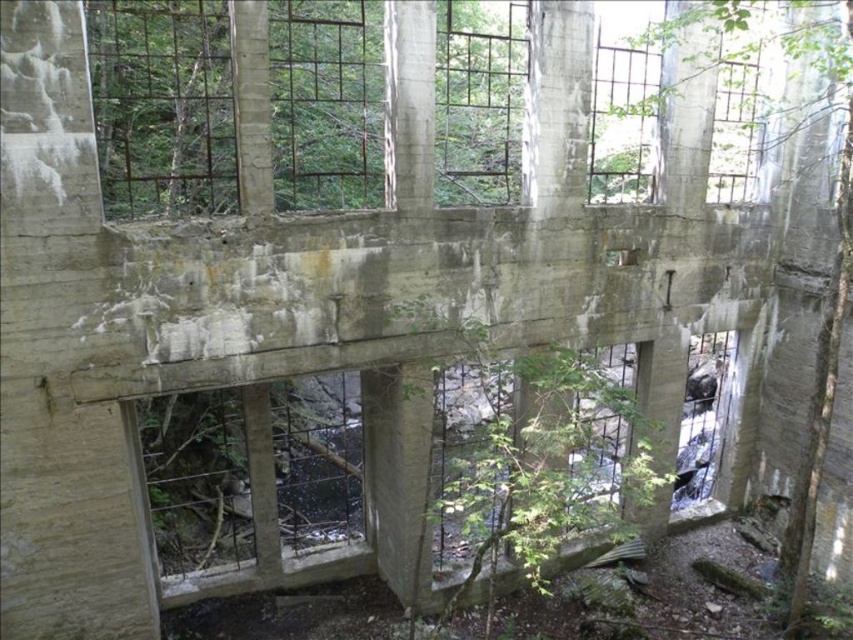
You are standing inside the dilapidated structure and notice the rusty metal window at center and the green leafy tree at right. Which object is closer to the ceiling?

The rusty metal window at center is positioned under the green leafy tree at right, meaning the tree is closer to the ceiling than the window.

You are standing in the center of the dilapidated structure. You need to locate the rusty metal window at center. What are the coordinates where you should look?

The coordinates for the rusty metal window at center are at point (254, 484).